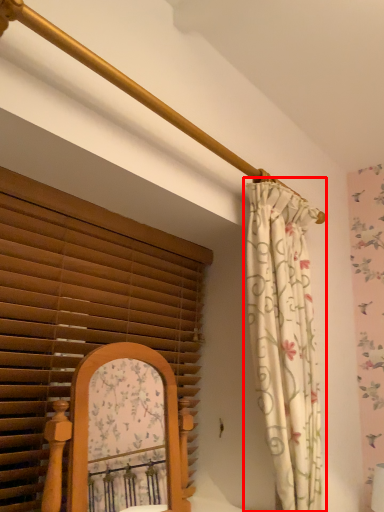
Question: From the image's perspective, where is curtain (annotated by the red box) located in relation to window blind in the image?

Choices:
 (A) above
 (B) below

Answer: (A)